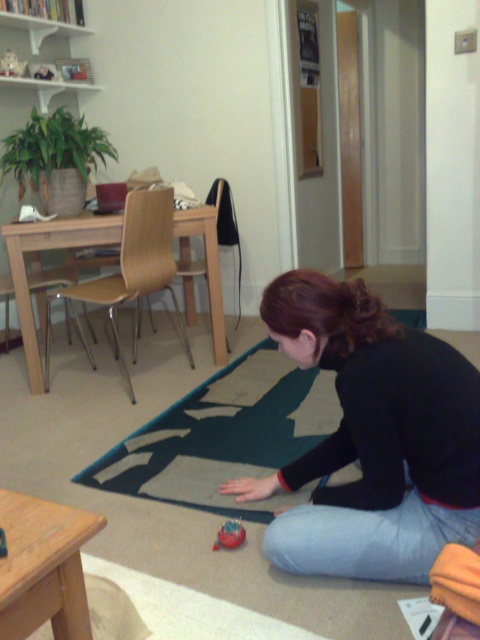
Question: Estimate the real-world distances between objects in this image. Which object is closer to the dark green fabric mat at lower center?

Choices:
 (A) wooden stool at lower left
 (B) shiny red ball at lower center

Answer: (B)

Question: Is dark green fabric mat at lower center positioned behind rubberized red toy at lower left?

Choices:
 (A) no
 (B) yes

Answer: (B)

Question: Which point is farther from the camera taking this photo?

Choices:
 (A) (0, 548)
 (B) (180, 442)
 (C) (79, 577)
 (D) (323, 520)

Answer: (B)

Question: From the image, what is the correct spatial relationship of black matte sweater at lower center in relation to wooden stool at lower left?

Choices:
 (A) above
 (B) below

Answer: (A)

Question: Is shiny red ball at lower center above rubberized red toy at lower left?

Choices:
 (A) no
 (B) yes

Answer: (A)

Question: Which point is farther from the camera taking this photo?

Choices:
 (A) (84, 593)
 (B) (283, 481)
 (C) (222, 531)
 (D) (309, 422)

Answer: (D)